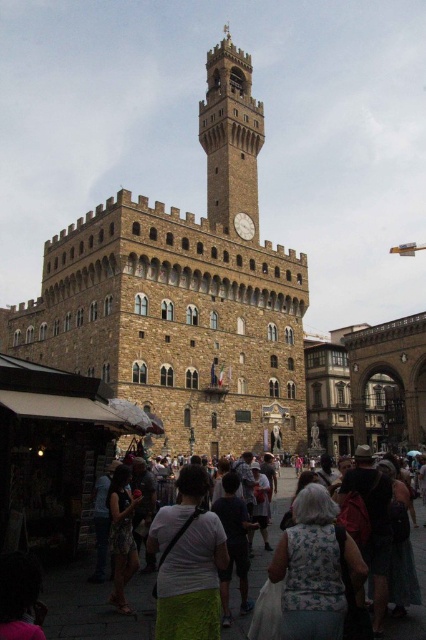
You are standing in the square in front of the historic building. You notice the stone clock tower at center and the white matte clock at center. Which object is taller?

The stone clock tower at center is much taller than the white matte clock at center.

You are standing in the square and want to take a photo of the stone clock tower at center without any people blocking the view. Since the floral dress at lower left is part of the crowd, where should you position yourself to avoid them?

The stone clock tower at center is located above the floral dress at lower left, so you should position yourself behind the floral dress at lower left to ensure the stone clock tower at center is visible without obstruction.